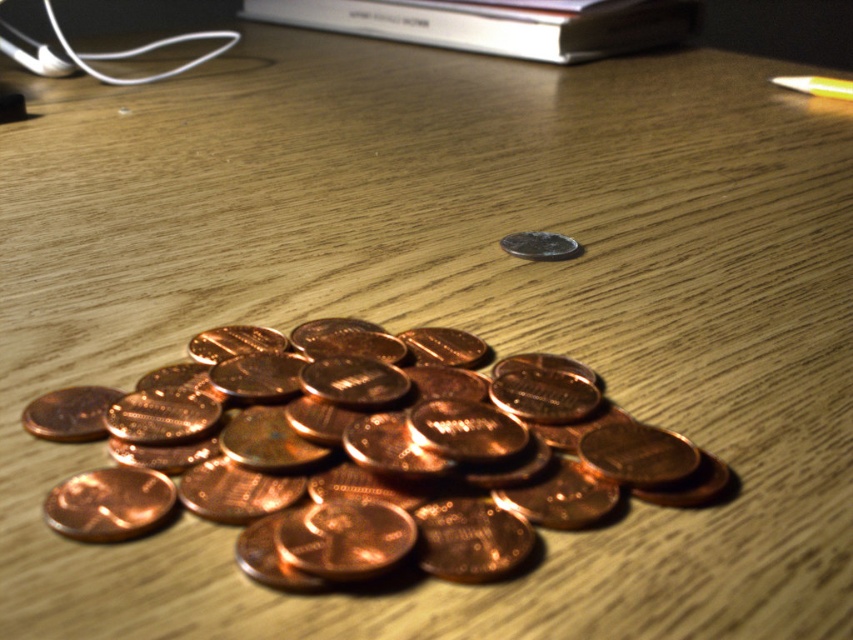
Question: From the image, what is the correct spatial relationship of copper metallic coins at center in relation to silver metallic book at upper center?

Choices:
 (A) below
 (B) above

Answer: (A)

Question: Is copper metallic coins at center positioned in front of silver metallic book at upper center?

Choices:
 (A) yes
 (B) no

Answer: (A)

Question: Which point appears farthest from the camera in this image?

Choices:
 (A) (538, 52)
 (B) (837, 97)

Answer: (A)

Question: Is copper metallic coins at center wider than metallic yellow pen at upper right?

Choices:
 (A) yes
 (B) no

Answer: (A)

Question: Which of the following is the closest to the observer?

Choices:
 (A) (561, 241)
 (B) (206, 476)
 (C) (795, 83)
 (D) (666, 8)

Answer: (B)

Question: Which point is closer to the camera?

Choices:
 (A) silver metallic book at upper center
 (B) copper metallic coins at center
 (C) metallic yellow pen at upper right
 (D) shiny silver coin at center

Answer: (B)